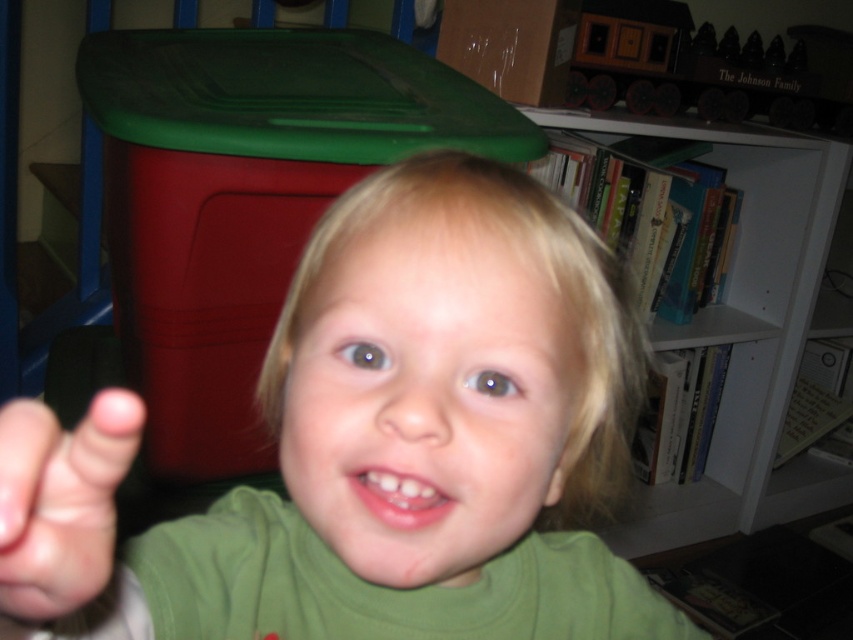
Question: Can you confirm if white matte bookshelf at upper right is bigger than pink flesh at center?

Choices:
 (A) yes
 (B) no

Answer: (A)

Question: Is white matte bookshelf at upper right positioned before pink flesh at center?

Choices:
 (A) yes
 (B) no

Answer: (B)

Question: Which is farther from the pink flesh at center?

Choices:
 (A) green matte shirt at center
 (B) white matte bookshelf at upper right

Answer: (B)

Question: Estimate the real-world distances between objects in this image. Which object is closer to the pink flesh at center?

Choices:
 (A) green matte shirt at center
 (B) white matte bookshelf at upper right

Answer: (A)

Question: Is green matte shirt at center wider than pink flesh at center?

Choices:
 (A) no
 (B) yes

Answer: (B)

Question: Which point is closer to the camera taking this photo?

Choices:
 (A) (20, 524)
 (B) (309, 536)
 (C) (790, 509)

Answer: (A)